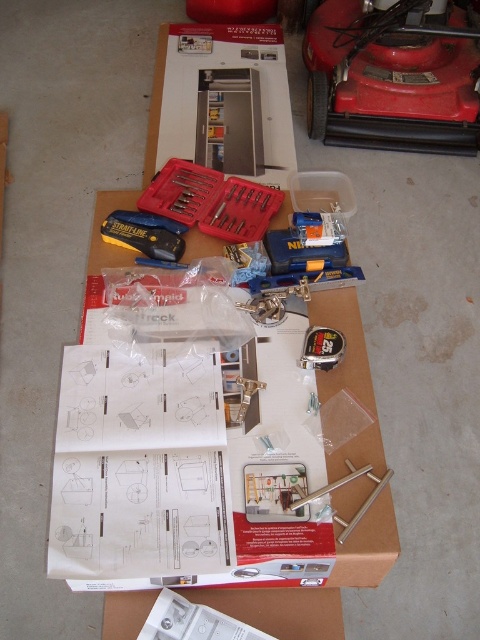
Can you confirm if brown cardboard box at center is taller than satin nickel cabinet handle at center?

Yes.

Which of these two, brown cardboard box at center or satin nickel cabinet handle at center, stands taller?

With more height is brown cardboard box at center.

I want to click on brown cardboard box at center, so click(317, 588).

Can you confirm if brown cardboard box at center is bigger than matte black tool at center?

Correct, brown cardboard box at center is larger in size than matte black tool at center.

Who is more forward, (x=343, y=621) or (x=170, y=243)?

Point (x=343, y=621) is in front.

Which is behind, point (369, 490) or point (156, 248)?

Point (156, 248)

The image size is (480, 640). Identify the location of brown cardboard box at center. [x=317, y=588].

Is matte black tool at center positioned behind satin nickel cabinet handle at center?

That is True.

Locate an element on the screen. This screenshot has height=640, width=480. matte black tool at center is located at coordinates (144, 234).

Locate an element on the screen. matte black tool at center is located at coordinates (144, 234).